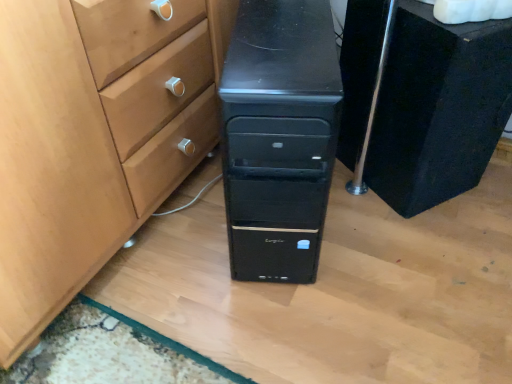
Question: Is point (387, 182) positioned closer to the camera than point (286, 97)?

Choices:
 (A) farther
 (B) closer

Answer: (A)

Question: Is black matte chest of drawers at center, which is the 2th chest of drawers from left to right, bigger or smaller than black matte chest of drawers at center, which ranks as the first chest of drawers in left-to-right order?

Choices:
 (A) small
 (B) big

Answer: (A)

Question: From the image's perspective, relative to black matte chest of drawers at center, which appears as the second chest of drawers when viewed from the right, is black matte chest of drawers at center, which is the 2th chest of drawers from left to right, above or below?

Choices:
 (A) below
 (B) above

Answer: (B)

Question: Relative to black matte chest of drawers at center, which is the 2th chest of drawers from left to right, is black matte chest of drawers at center, which appears as the second chest of drawers when viewed from the right, in front or behind?

Choices:
 (A) front
 (B) behind

Answer: (A)

Question: From the image's perspective, is black matte chest of drawers at center, which appears as the second chest of drawers when viewed from the right, positioned above or below black matte chest of drawers at center, which appears as the first chest of drawers when viewed from the right?

Choices:
 (A) below
 (B) above

Answer: (A)

Question: From a real-world perspective, is black matte chest of drawers at center, which ranks as the first chest of drawers in left-to-right order, positioned above or below black matte chest of drawers at center, which is the 2th chest of drawers from left to right?

Choices:
 (A) below
 (B) above

Answer: (B)

Question: Considering the positions of black matte chest of drawers at center, which ranks as the first chest of drawers in left-to-right order, and black matte chest of drawers at center, which is the 2th chest of drawers from left to right, in the image, is black matte chest of drawers at center, which ranks as the first chest of drawers in left-to-right order, wider or thinner than black matte chest of drawers at center, which is the 2th chest of drawers from left to right,?

Choices:
 (A) thin
 (B) wide

Answer: (B)